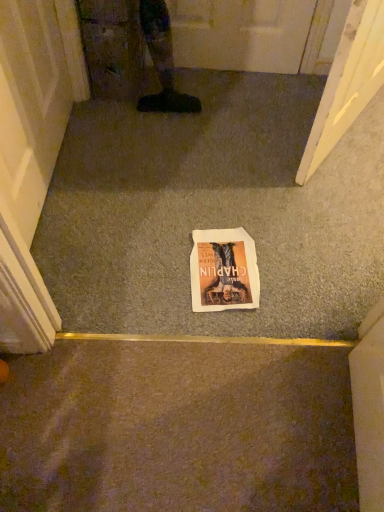
Question: Considering the positions of white paper at center and white paper comic book at center in the image, is white paper at center taller or shorter than white paper comic book at center?

Choices:
 (A) tall
 (B) short

Answer: (A)

Question: Visually, is white paper at center positioned to the left or to the right of white paper comic book at center?

Choices:
 (A) right
 (B) left

Answer: (A)

Question: Is point tap(200, 209) positioned closer to the camera than point tap(205, 283)?

Choices:
 (A) closer
 (B) farther

Answer: (B)

Question: Is point (251, 308) closer or farther from the camera than point (155, 202)?

Choices:
 (A) farther
 (B) closer

Answer: (B)

Question: Looking at the image, does white paper comic book at center seem bigger or smaller compared to white paper at center?

Choices:
 (A) small
 (B) big

Answer: (A)

Question: Do you think white paper comic book at center is within white paper at center, or outside of it?

Choices:
 (A) inside
 (B) outside

Answer: (A)

Question: Is white paper comic book at center in front of or behind white paper at center in the image?

Choices:
 (A) behind
 (B) front

Answer: (A)